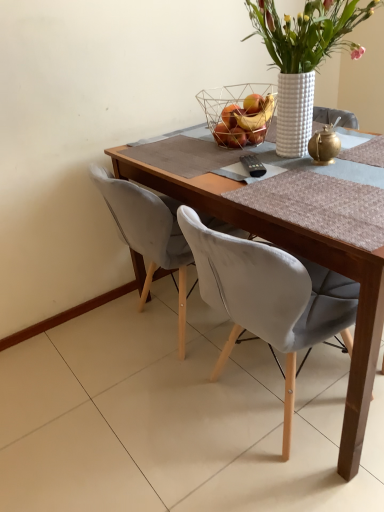
The height and width of the screenshot is (512, 384). I want to click on vacant area in front of gold metallic teapot at upper right, so click(x=336, y=181).